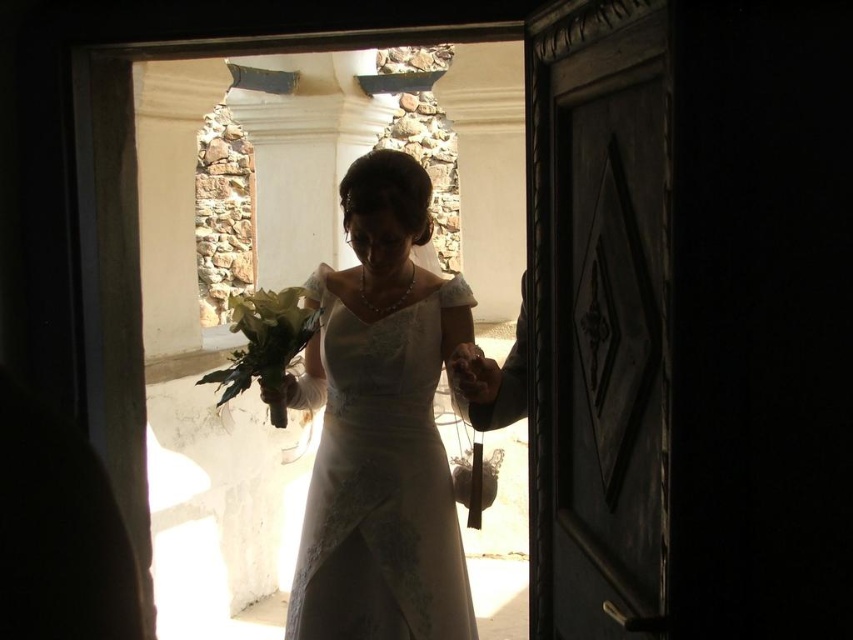
You are a photographer trying to capture the bride in the doorway. Since the white satin dress at center and the green leafy bouquet at center are both in the frame, which one should you focus on to ensure the subject is properly lit?

The white satin dress at center is in front of the green leafy bouquet at center, so focusing on the white satin dress at center will ensure proper lighting since it is closer to the light source.

You are a photographer trying to capture the bride in the doorway. You need to ensure both the white satin dress at center and the green leafy bouquet at center are clearly visible in the photo. Given their sizes, which object might require more careful lighting adjustments to prevent it from being overshadowed by the bright background?

The white satin dress at center has a larger size compared to the green leafy bouquet at center. Since the dress is larger, it may require more careful lighting adjustments to ensure it doesn

You are a photographer capturing the bride at the doorway. You need to adjust your camera focus to ensure both the white satin dress at center and the green leafy bouquet at center are in sharp focus. Which object should you focus on first to achieve this?

To ensure both the white satin dress at center and the green leafy bouquet at center are in sharp focus, you should focus on the green leafy bouquet at center first since it is closer to the camera than the white satin dress at center.